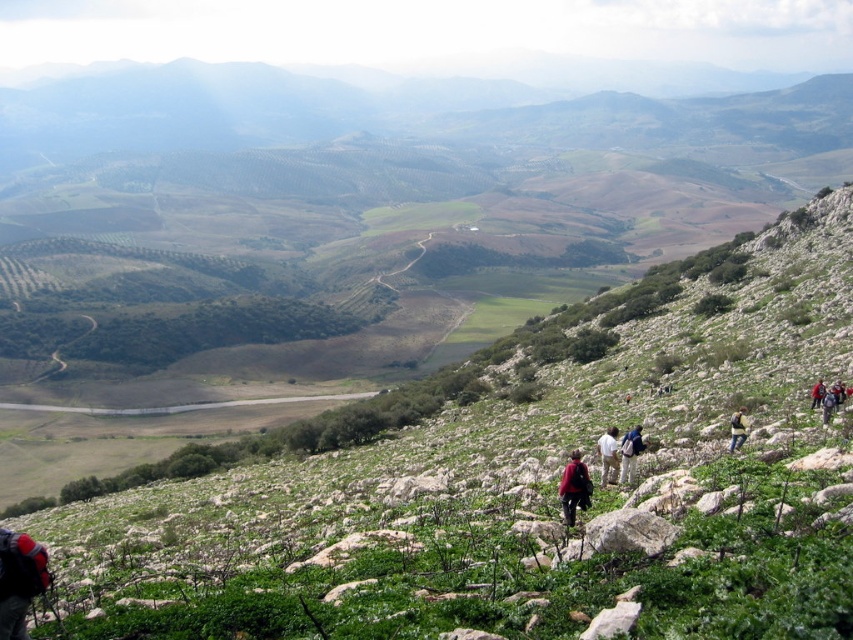
Who is more distant from viewer, (634, 428) or (741, 435)?

The point (634, 428) is behind.

Who is lower down, blue fabric backpack at center-right or dark blue backpack at lower right?

Positioned lower is blue fabric backpack at center-right.

Is point (637, 448) behind point (743, 440)?

No, it is not.

Where is `blue fabric backpack at center-right`? The width and height of the screenshot is (853, 640). blue fabric backpack at center-right is located at coordinates (630, 452).

Is dark red backpack at center to the right of light brown fabric backpack at lower right from the viewer's perspective?

In fact, dark red backpack at center is to the left of light brown fabric backpack at lower right.

Who is shorter, dark red backpack at center or light brown fabric backpack at lower right?

light brown fabric backpack at lower right is shorter.

This screenshot has height=640, width=853. I want to click on dark red backpack at center, so click(x=573, y=486).

Is light brown fabric backpack at lower right above blue fabric backpack at center-right?

Actually, light brown fabric backpack at lower right is below blue fabric backpack at center-right.

Between point (608, 470) and point (639, 449), which one is positioned in front?

Positioned in front is point (639, 449).

Identify the location of light brown fabric backpack at lower right. The height and width of the screenshot is (640, 853). pos(608,456).